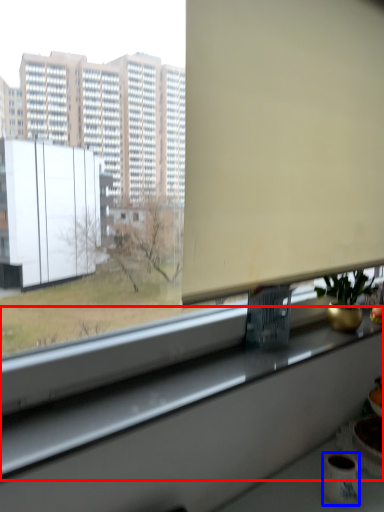
Question: Which object appears closest to the camera in this image, window sill (highlighted by a red box) or mug (highlighted by a blue box)?

Choices:
 (A) window sill
 (B) mug

Answer: (A)